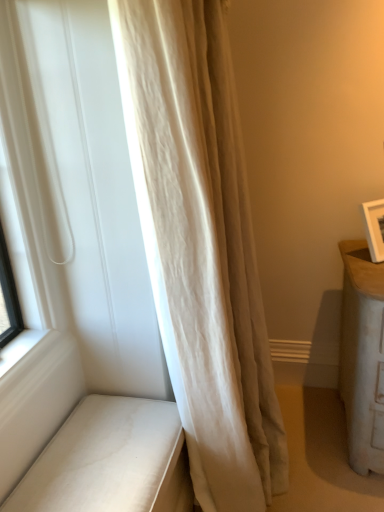
Where is `vacant point above white leather bench at lower left (from a real-world perspective)`? This screenshot has height=512, width=384. vacant point above white leather bench at lower left (from a real-world perspective) is located at coordinates (110, 445).